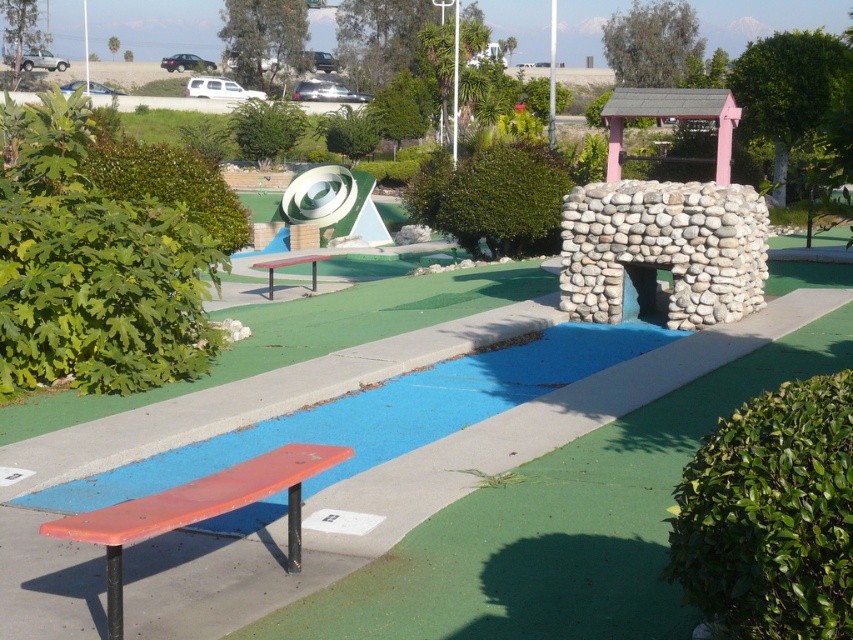
You are a golfer standing at the starting point of the course and see the matte orange bench at lower left and the red painted wood bench at center. Which bench is closer to your current position?

The matte orange bench at lower left is positioned on the right side of the red painted wood bench at center, so the red painted wood bench at center is closer to your current position as it is in the center path.

You are standing at the center of the miniature golf course and want to find the matte orange bench at lower left. According to the coordinates provided, in which direction should you walk to reach it?

The matte orange bench at lower left is located at coordinates point (198, 509). Since the x coordinate is 0.797, which is closer to the right edge of the image, and the y coordinate is 0.233, closer to the bottom edge, you should walk towards the lower right direction to reach it.

You are standing at the starting point of the miniature golf course and see the point marked at coordinates (198, 509). What object is located at that point?

The point at coordinates (198, 509) marks the location of the matte orange bench at lower left.